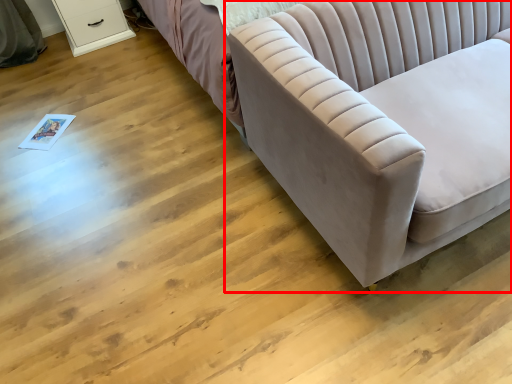
Question: From the image's perspective, considering the relative positions of studio couch (annotated by the red box) and dresser in the image provided, where is studio couch (annotated by the red box) located with respect to the staircase?

Choices:
 (A) below
 (B) above

Answer: (A)